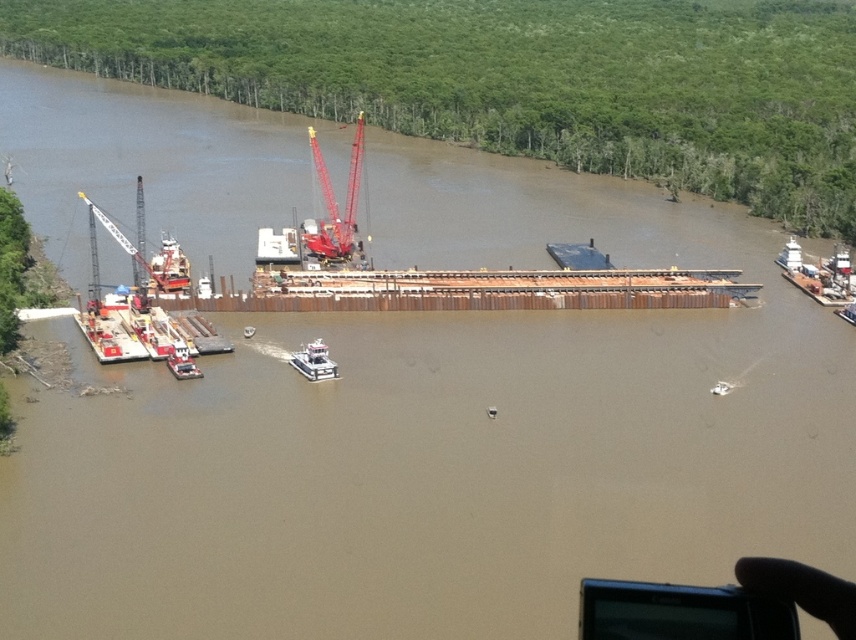
Question: Which of the following is the closest to the observer?

Choices:
 (A) white plastic boat at center
 (B) white matte barge at center
 (C) metallic gray barge at lower left

Answer: (B)

Question: Can you confirm if white matte barge at center is positioned above white plastic boat at center?

Choices:
 (A) yes
 (B) no

Answer: (A)

Question: Does metallic gray barge at lower left have a lesser width compared to white plastic boat at center?

Choices:
 (A) yes
 (B) no

Answer: (B)

Question: Does metallic gray barge at lower left have a smaller size compared to white plastic boat at center?

Choices:
 (A) no
 (B) yes

Answer: (A)

Question: Which point is closer to the camera taking this photo?

Choices:
 (A) click(171, 349)
 (B) click(84, 320)
 (C) click(316, 355)

Answer: (C)

Question: Which point is farther to the camera?

Choices:
 (A) (185, 371)
 (B) (99, 353)

Answer: (B)